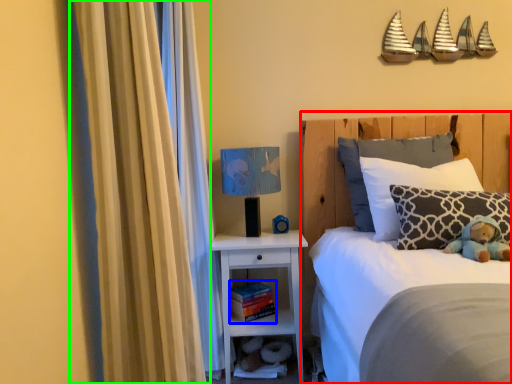
Question: Which object is the closest to the bed (highlighted by a red box)? Choose among these: book (highlighted by a blue box) or curtain (highlighted by a green box).

Choices:
 (A) book
 (B) curtain

Answer: (A)